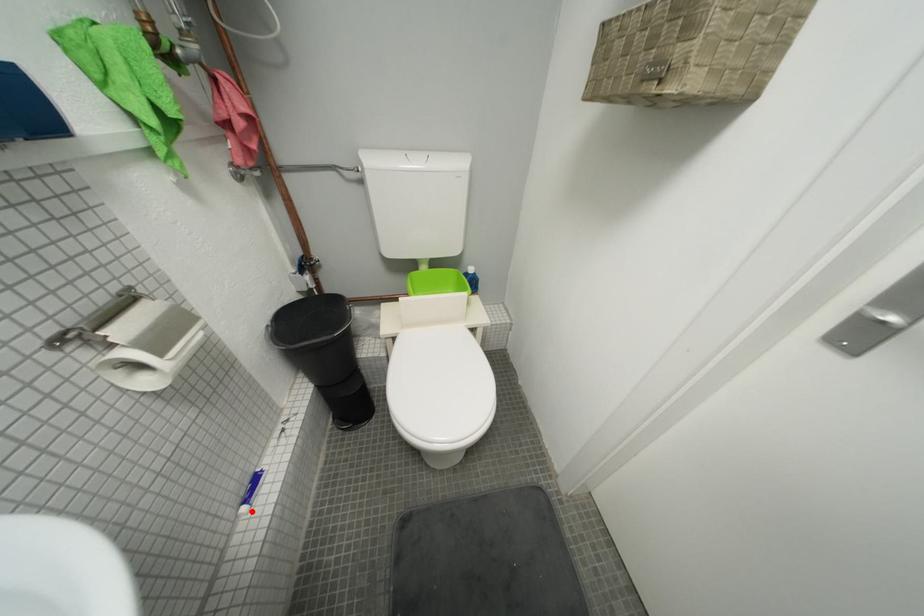
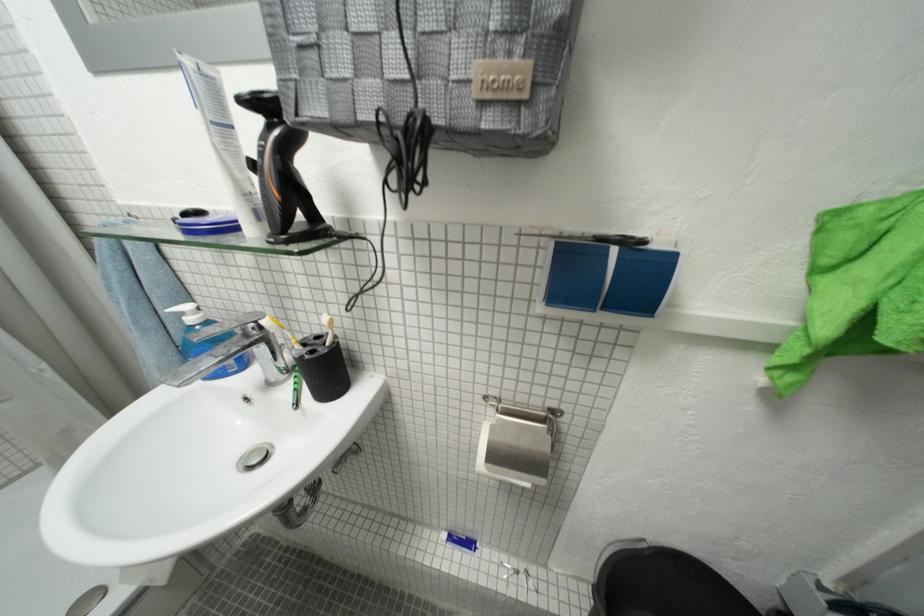
Locate, in the second image, the point that corresponds to the highlighted location in the first image.

(454, 538)